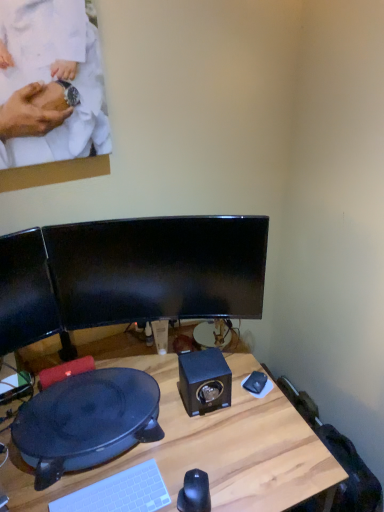
This screenshot has height=512, width=384. Find the location of `free space in front of black matte speaker at center`. free space in front of black matte speaker at center is located at coordinates (206, 444).